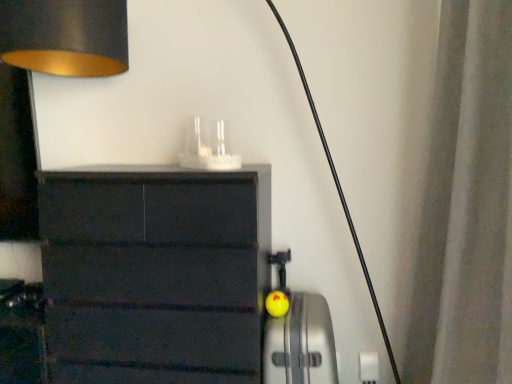
Question: Is point (322, 380) positioned closer to the camera than point (439, 34)?

Choices:
 (A) closer
 (B) farther

Answer: (A)

Question: Considering the positions of yellow rubber ball at center and white fabric curtain at right in the image, is yellow rubber ball at center taller or shorter than white fabric curtain at right?

Choices:
 (A) short
 (B) tall

Answer: (A)

Question: Considering their positions, is yellow rubber ball at center located in front of or behind white fabric curtain at right?

Choices:
 (A) behind
 (B) front

Answer: (A)

Question: Considering their positions, is white fabric curtain at right located in front of or behind yellow rubber ball at center?

Choices:
 (A) behind
 (B) front

Answer: (B)

Question: From a real-world perspective, relative to yellow rubber ball at center, is white fabric curtain at right vertically above or below?

Choices:
 (A) below
 (B) above

Answer: (B)

Question: Based on their positions, is white fabric curtain at right located to the left or right of yellow rubber ball at center?

Choices:
 (A) left
 (B) right

Answer: (B)

Question: Considering the positions of point (471, 269) and point (263, 372), is point (471, 269) closer or farther from the camera than point (263, 372)?

Choices:
 (A) farther
 (B) closer

Answer: (B)